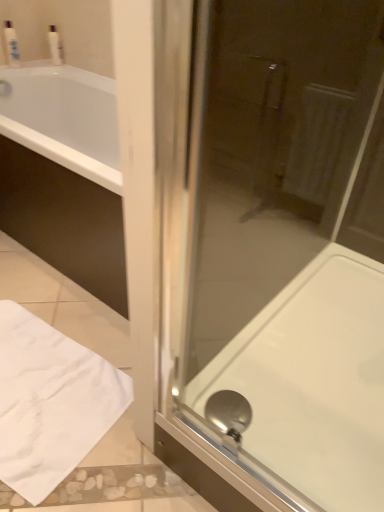
This screenshot has height=512, width=384. In order to click on vacant region to the right of white glossy bottle at upper left, the 2th toiletry positioned from the left in this screenshot , I will do `click(69, 69)`.